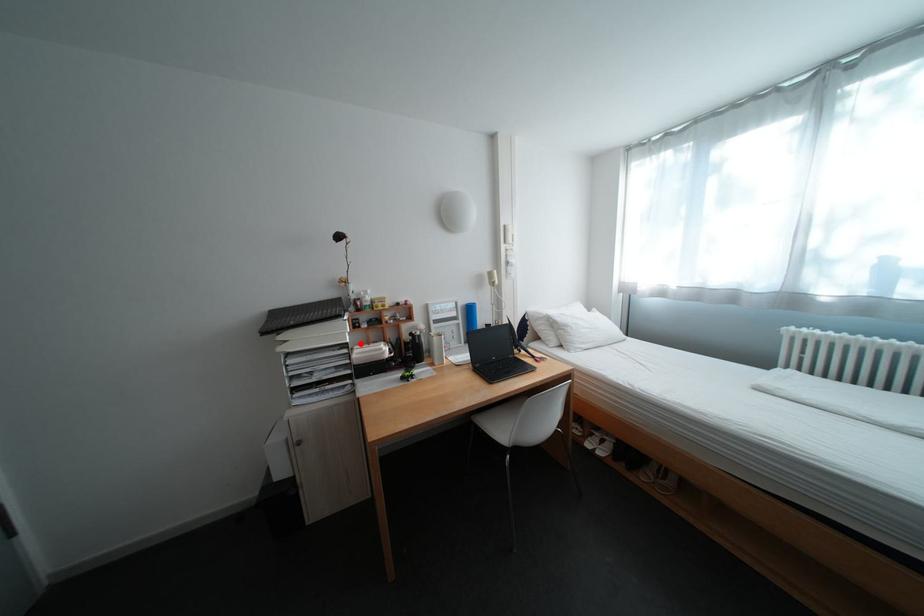
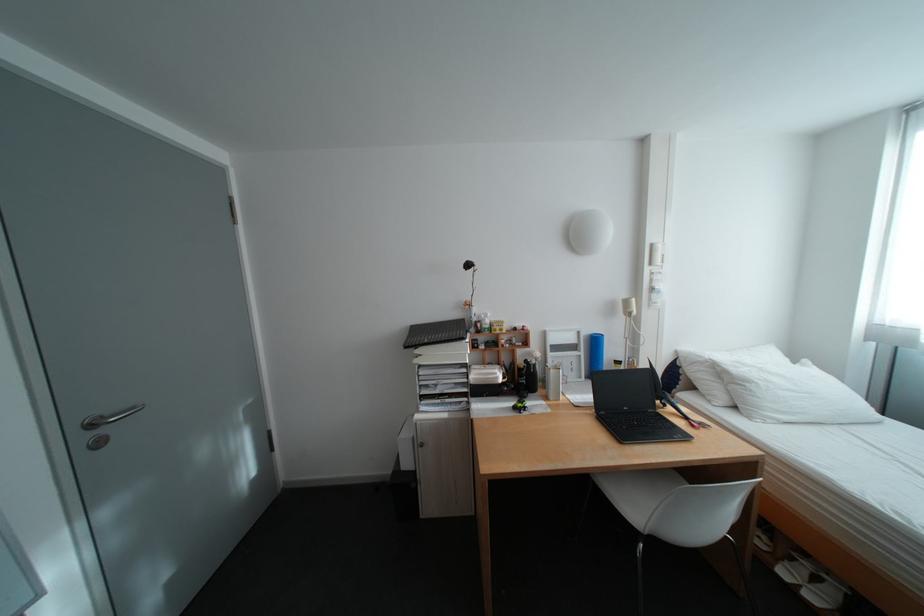
In the second image, find the point that corresponds to the highlighted location in the first image.

(480, 363)